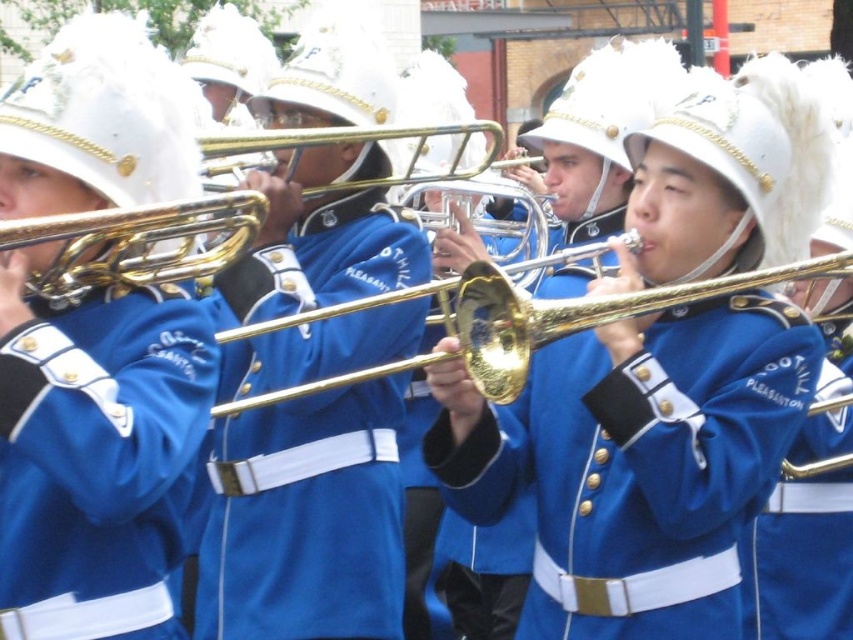
Does blue fabric uniform at center have a greater width compared to gold brass trumpet at center?

Yes, blue fabric uniform at center is wider than gold brass trumpet at center.

Which is behind, point (328, 529) or point (187, 240)?

The point (328, 529) is behind.

You are a GUI agent. You are given a task and a screenshot of the screen. Output one action in this format:
    pyautogui.click(x=<x>, y=<y>)
    Task: Click on the blue fabric uniform at center
    
    Given the screenshot: What is the action you would take?
    pyautogui.click(x=305, y=518)

Can you confirm if matte gold trombone at center is smaller than gold brass trombone at center?

No, matte gold trombone at center is not smaller than gold brass trombone at center.

Who is more forward, (x=105, y=24) or (x=337, y=307)?

Point (x=105, y=24)

Where is `matte gold trombone at center`? matte gold trombone at center is located at coordinates (x=97, y=445).

Is matte gold trombone at center above gold polished trombone at center?

No.

From the picture: Does matte gold trombone at center have a greater width compared to gold polished trombone at center?

No.

Which is behind, point (90, 385) or point (505, 276)?

The point (505, 276) is more distant.

The height and width of the screenshot is (640, 853). In order to click on matte gold trombone at center in this screenshot , I will do `click(97, 445)`.